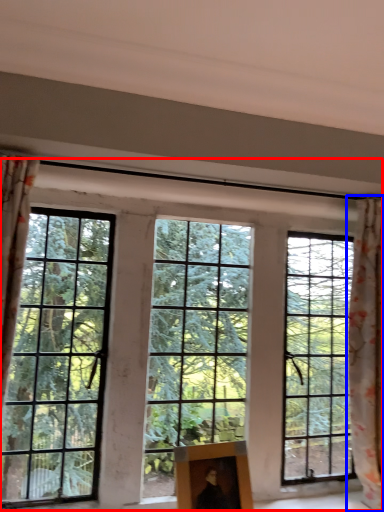
Question: Which object is further to the camera taking this photo, window (highlighted by a red box) or curtain (highlighted by a blue box)?

Choices:
 (A) window
 (B) curtain

Answer: (B)